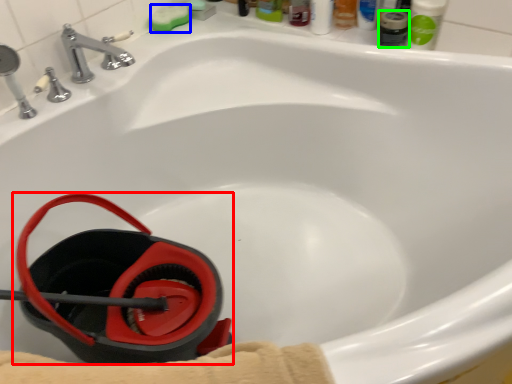
Question: Which object is positioned farthest from job (highlighted by a red box)? Select from soap (highlighted by a blue box) and mouthwash (highlighted by a green box).

Choices:
 (A) soap
 (B) mouthwash

Answer: (B)